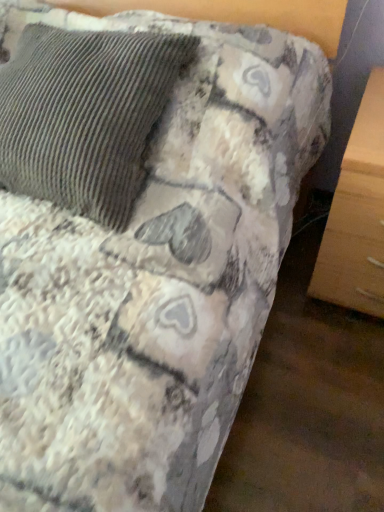
Question: In the image, is textured corduroy pillow at upper left positioned in front of or behind light wood drawer at lower right?

Choices:
 (A) front
 (B) behind

Answer: (A)

Question: Do you think textured corduroy pillow at upper left is within light wood drawer at lower right, or outside of it?

Choices:
 (A) inside
 (B) outside

Answer: (B)

Question: Looking at their shapes, would you say textured corduroy pillow at upper left is wider or thinner than light wood drawer at lower right?

Choices:
 (A) wide
 (B) thin

Answer: (B)

Question: Is light wood drawer at lower right in front of or behind textured corduroy pillow at upper left in the image?

Choices:
 (A) behind
 (B) front

Answer: (A)

Question: Considering the positions of point (352, 202) and point (107, 105), is point (352, 202) closer or farther from the camera than point (107, 105)?

Choices:
 (A) closer
 (B) farther

Answer: (B)

Question: Choose the correct answer: Is light wood drawer at lower right inside textured corduroy pillow at upper left or outside it?

Choices:
 (A) outside
 (B) inside

Answer: (A)

Question: Would you say light wood drawer at lower right is to the left or to the right of textured corduroy pillow at upper left in the picture?

Choices:
 (A) left
 (B) right

Answer: (B)